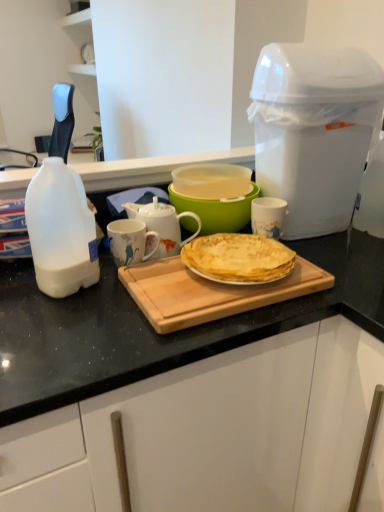
Where is `blank area to the left of yellow crepe at center`? The width and height of the screenshot is (384, 512). blank area to the left of yellow crepe at center is located at coordinates (150, 276).